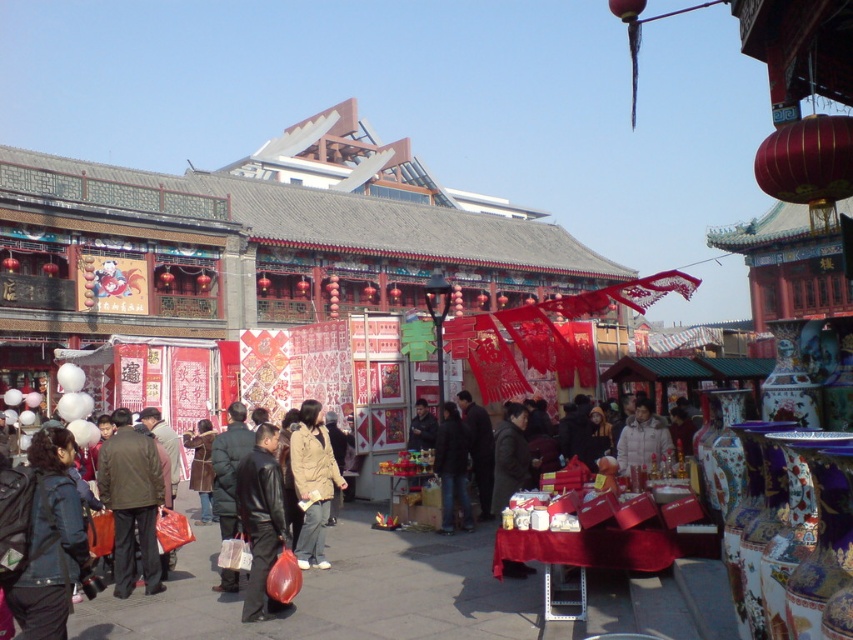
You are standing in the middle of the market and want to reach both the red paper cutouts stall and the porcelain vases stall. The red paper cutouts stall is located at point (273, 493) and the porcelain vases stall is at point (453, 428). Which stall will you reach first if you move straight towards them?

You will reach the red paper cutouts stall at point (273, 493) first because it is closer to you than the porcelain vases stall at point (453, 428).

You are a customer at the market and want to buy a dark brown leather jacket at center. The vendor tells you that the jacket is placed exactly at the point marked by coordinates point [131,502]. Can you locate it using the coordinates?

The point [131,502] marks the dark brown leather jacket at center, so yes, you can locate it there.